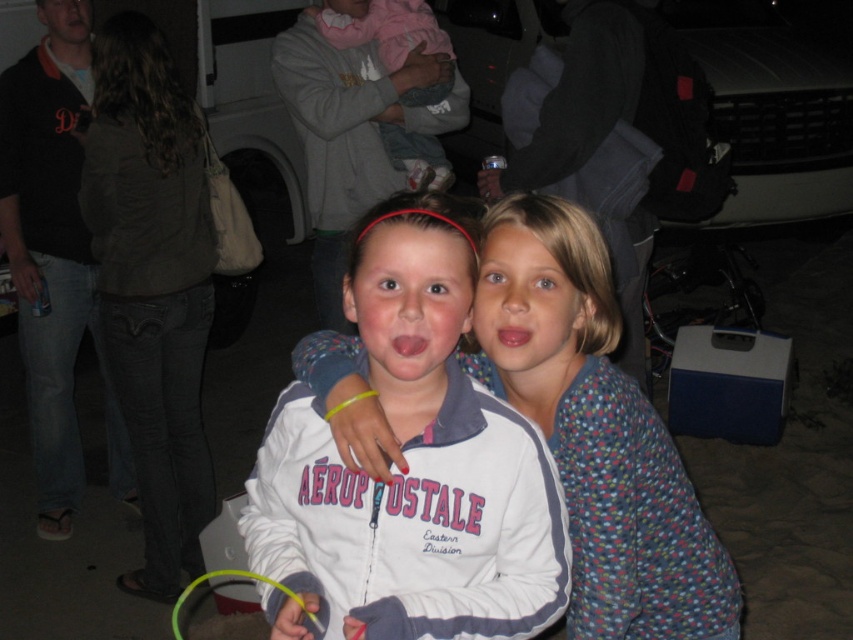
Question: Which point is closer to the camera taking this photo?

Choices:
 (A) (517, 333)
 (B) (339, 0)

Answer: (A)

Question: Does fluffy pink blanket at upper center appear over smooth skin face at center?

Choices:
 (A) yes
 (B) no

Answer: (B)

Question: Based on their relative distances, which object is farther from the fluffy pink blanket at upper center?

Choices:
 (A) pink fabric at center
 (B) matte blue face at center

Answer: (B)

Question: Is white fleece jacket at center to the right of smooth skin face at center from the viewer's perspective?

Choices:
 (A) no
 (B) yes

Answer: (B)

Question: Which point appears farthest from the camera in this image?

Choices:
 (A) (363, 3)
 (B) (428, 529)

Answer: (A)

Question: Is white fleece jacket at center below pink matte lips at center?

Choices:
 (A) yes
 (B) no

Answer: (A)